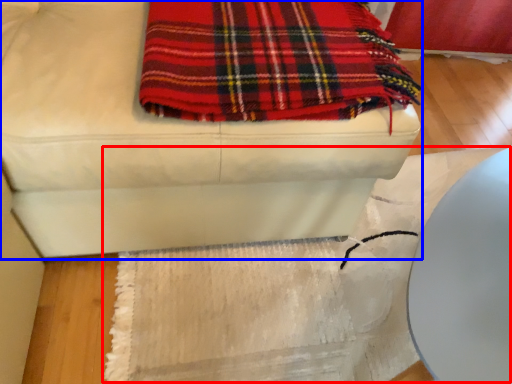
Question: Which object is further to the camera taking this photo, mat (highlighted by a red box) or furniture (highlighted by a blue box)?

Choices:
 (A) mat
 (B) furniture

Answer: (A)